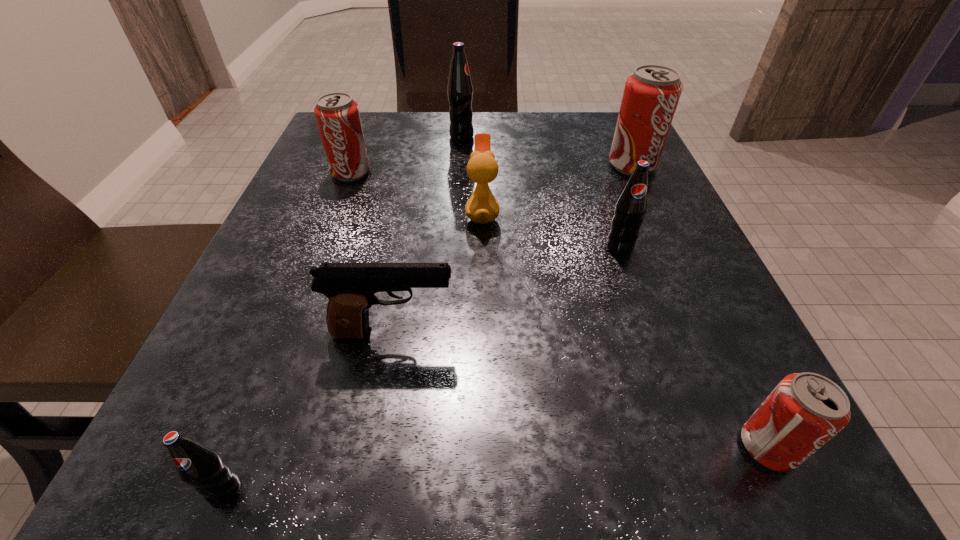
You are a GUI agent. You are given a task and a screenshot of the screen. Output one action in this format:
    pyautogui.click(x=<x>, y=<y>)
    Task: Click on the vacant space positioned 0.090m on the beak of the tan duck
    Image resolution: width=960 pixels, height=540 pixels.
    Given the screenshot: What is the action you would take?
    pyautogui.click(x=416, y=213)

Locate an element on the screen. This screenshot has height=540, width=960. vacant region located 0.170m on the back of the smallest pink soda can is located at coordinates (703, 309).

Identify the location of pistol that is at the left edge. This screenshot has height=540, width=960. (350, 287).

You are a GUI agent. You are given a task and a screenshot of the screen. Output one action in this format:
    pyautogui.click(x=<x>, y=<y>)
    Task: Click on the object present at the far left corner
    This screenshot has height=540, width=960.
    Given the screenshot: What is the action you would take?
    pyautogui.click(x=337, y=114)

The height and width of the screenshot is (540, 960). Find the location of `object at the near left corner`. object at the near left corner is located at coordinates (199, 466).

Locate an element on the screen. The height and width of the screenshot is (540, 960). object that is at the far right corner is located at coordinates (651, 94).

You are a GUI agent. You are given a task and a screenshot of the screen. Output one action in this format:
    pyautogui.click(x=<x>, y=<y>)
    Task: Click on the object present at the near right corner
    The image size is (960, 540).
    Given the screenshot: What is the action you would take?
    pyautogui.click(x=805, y=410)

I want to click on vacant space at the far edge, so click(543, 113).

The width and height of the screenshot is (960, 540). In the image, there is a desktop. What are the coordinates of `vacant space at the near edge` in the screenshot? It's located at (601, 500).

Where is `vacant space at the left edge`? Image resolution: width=960 pixels, height=540 pixels. vacant space at the left edge is located at coordinates (246, 288).